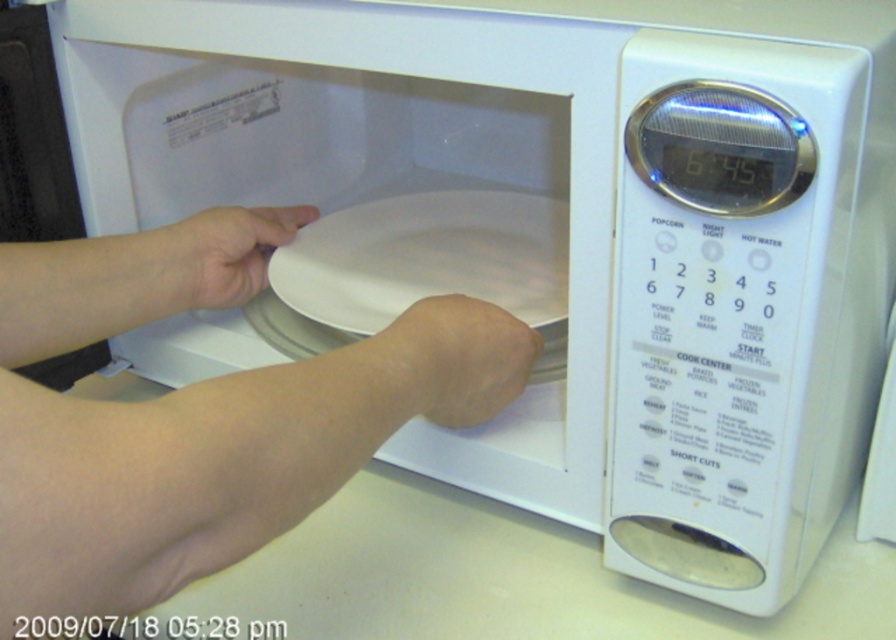
Based on the photo, is skinny flesh at lower center bigger than white matte plate at left?

Actually, skinny flesh at lower center might be smaller than white matte plate at left.

Can you confirm if skinny flesh at lower center is smaller than white matte plate at left?

Yes.

Is point (463, 403) positioned behind point (214, 301)?

No, (463, 403) is closer to viewer.

At what (x,y) coordinates should I click in order to perform the action: click on skinny flesh at lower center. Please return your answer as a coordinate pair (x, y). The height and width of the screenshot is (640, 896). Looking at the image, I should click on (455, 360).

Who is more distant from viewer, (151,435) or (487,248)?

The point (487,248) is behind.

Which is above, skinny white arm at center or white matte plate at center?

white matte plate at center is above.

Is point (159, 492) behind point (522, 224)?

No, it is not.

Identify the location of skinny white arm at center. Image resolution: width=896 pixels, height=640 pixels. (200, 413).

Is white matte plate at center wider than skinny flesh at lower center?

Yes.

Between white matte plate at center and skinny flesh at lower center, which one is positioned lower?

skinny flesh at lower center

Find the location of a particular element. This screenshot has width=896, height=640. white matte plate at center is located at coordinates (427, 257).

This screenshot has width=896, height=640. Identify the location of white matte plate at center. (427, 257).